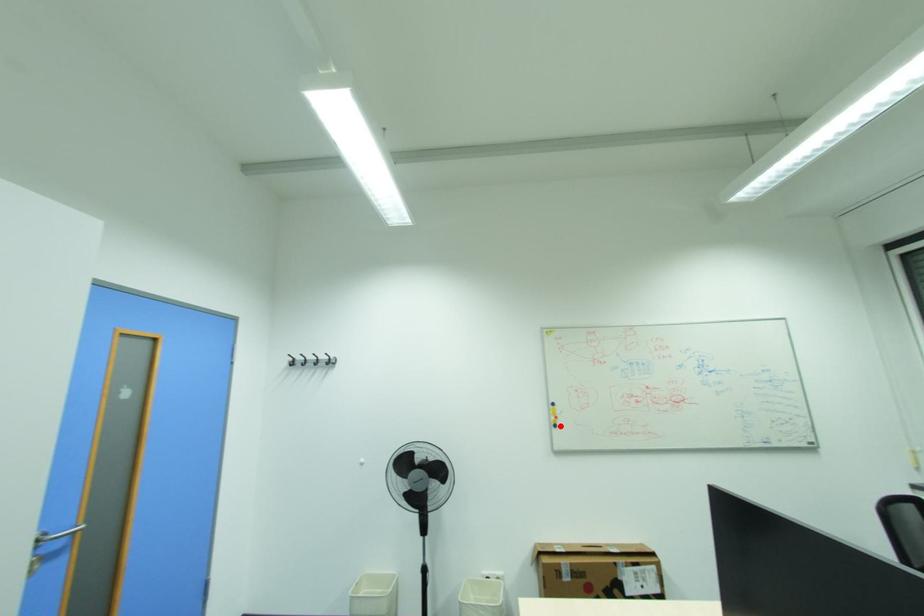
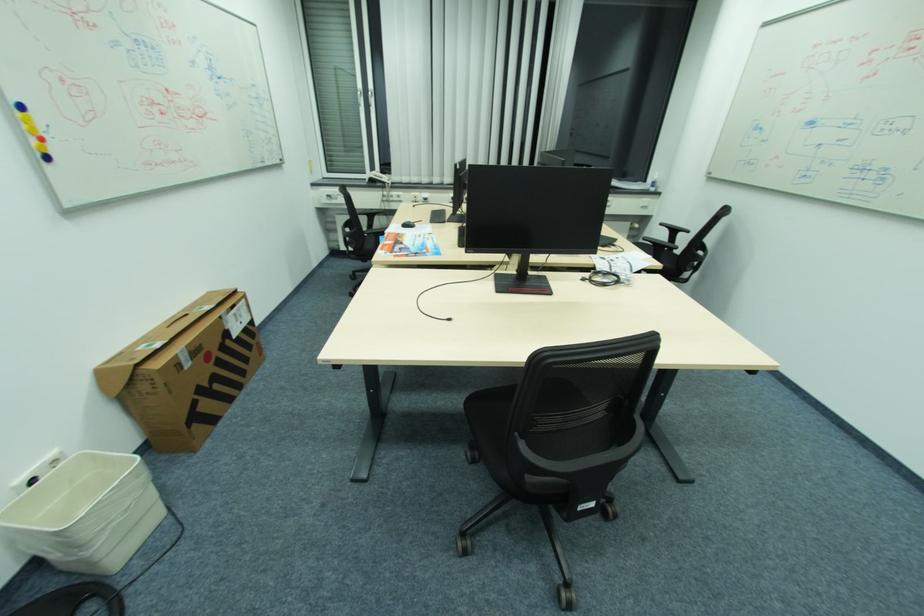
In the second image, find the point that corresponds to the highlighted location in the first image.

(52, 158)